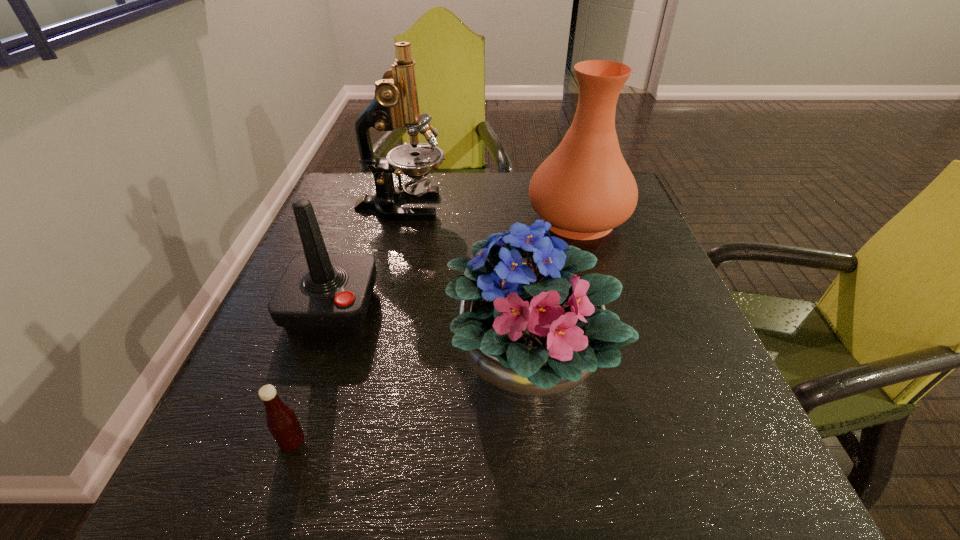
Identify which object is located as the second nearest to the vase. Please provide its 2D coordinates. Your answer should be formatted as a tuple, i.e. [(x, y)], where the tuple contains the x and y coordinates of a point satisfying the conditions above.

[(395, 103)]

Locate which object is the closest to the bouquet. Please provide its 2D coordinates. Your answer should be formatted as a tuple, i.e. [(x, y)], where the tuple contains the x and y coordinates of a point satisfying the conditions above.

[(319, 292)]

You are a GUI agent. You are given a task and a screenshot of the screen. Output one action in this format:
    pyautogui.click(x=<x>, y=<y>)
    Task: Click on the vacant space that satisfies the following two spatial constraints: 1. on the back side of the joystick; 2. on the right side of the vase
    
    Given the screenshot: What is the action you would take?
    pyautogui.click(x=363, y=219)

I want to click on vacant space that satisfies the following two spatial constraints: 1. at the eyepiece of the microscope; 2. on the back side of the vase, so click(x=399, y=219).

The image size is (960, 540). I want to click on vacant region that satisfies the following two spatial constraints: 1. on the back side of the shortest object; 2. on the right side of the bouquet, so click(x=320, y=364).

You are a GUI agent. You are given a task and a screenshot of the screen. Output one action in this format:
    pyautogui.click(x=<x>, y=<y>)
    Task: Click on the free location that satisfies the following two spatial constraints: 1. at the eyepiece of the microscope; 2. on the front side of the joystick
    This screenshot has height=540, width=960.
    Given the screenshot: What is the action you would take?
    pyautogui.click(x=377, y=307)

The image size is (960, 540). What are the coordinates of `vacant area that satisfies the following two spatial constraints: 1. on the back side of the bouquet; 2. at the eyepiece of the microscope` in the screenshot? It's located at (511, 207).

Find the location of a particular element. This screenshot has width=960, height=540. free space that satisfies the following two spatial constraints: 1. at the eyepiece of the microscope; 2. on the left side of the vase is located at coordinates (399, 219).

The image size is (960, 540). I want to click on vacant space that satisfies the following two spatial constraints: 1. on the back side of the Tabasco sauce; 2. on the left side of the vase, so click(x=369, y=219).

Find the location of a particular element. The image size is (960, 540). vacant space that satisfies the following two spatial constraints: 1. at the eyepiece of the bouquet; 2. on the left side of the microscope is located at coordinates (363, 364).